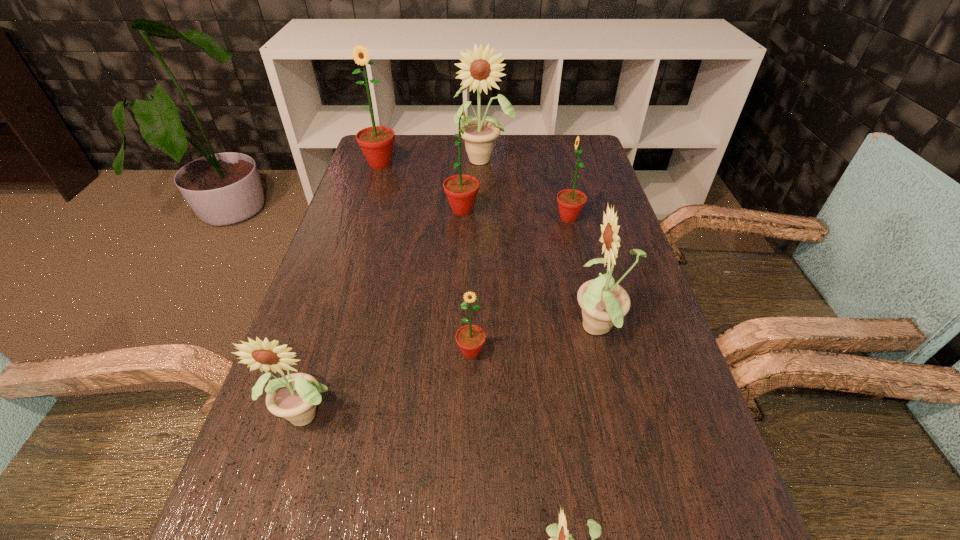
I want to click on blank area located 0.220m on the face of the smallest green sunflower, so click(468, 480).

Identify the location of object that is at the far left corner. (376, 142).

Find the location of a particular element. The width and height of the screenshot is (960, 540). free space at the far edge of the desktop is located at coordinates (455, 152).

Where is `free region at the left edge of the desktop`? The width and height of the screenshot is (960, 540). free region at the left edge of the desktop is located at coordinates (308, 467).

You are a GUI agent. You are given a task and a screenshot of the screen. Output one action in this format:
    pyautogui.click(x=<x>, y=<y>)
    Task: Click on the blank area at the right edge
    The height and width of the screenshot is (540, 960).
    Given the screenshot: What is the action you would take?
    coord(578,174)

In order to click on vacant space at the far left corner of the desktop in this screenshot , I will do `click(396, 141)`.

The height and width of the screenshot is (540, 960). Identify the location of vacant space at the far right corner of the desktop. (564, 145).

Identify the location of empty space between the third biggest yellow sunflower and the second biggest green sunflower. (386, 311).

At what (x,y) coordinates should I click in order to perform the action: click on free point between the second nearest sunflower and the biggest green sunflower. Please return your answer as a coordinate pair (x, y). The width and height of the screenshot is (960, 540). Looking at the image, I should click on (345, 288).

You are a GUI agent. You are given a task and a screenshot of the screen. Output one action in this format:
    pyautogui.click(x=<x>, y=<y>)
    Task: Click on the free space that is in between the rightmost green sunflower and the third biggest yellow sunflower
    Image resolution: width=960 pixels, height=540 pixels.
    Given the screenshot: What is the action you would take?
    pyautogui.click(x=439, y=315)